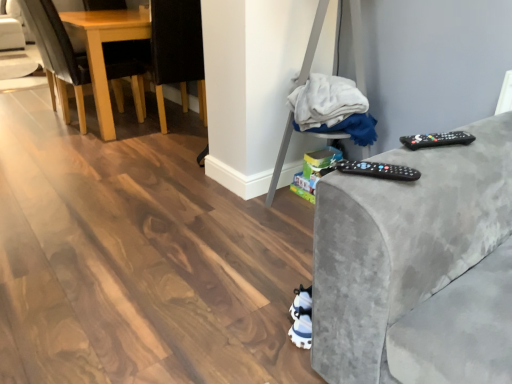
Measure the distance between white fabric at center and camera.

white fabric at center is 5.87 feet from camera.

The image size is (512, 384). What do you see at coordinates (176, 51) in the screenshot? I see `black fabric chair at left, which is counted as the 2th chair, starting from the left` at bounding box center [176, 51].

This screenshot has width=512, height=384. I want to click on light brown wood chair at left, the second chair in the right-to-left sequence, so click(57, 55).

Locate an element on the screen. The width and height of the screenshot is (512, 384). black plastic remote at right, the second remote in the right-to-left sequence is located at coordinates (378, 170).

This screenshot has width=512, height=384. Find the location of `the 1st remote above the white fabric at center (from a real-world perspective)`. the 1st remote above the white fabric at center (from a real-world perspective) is located at coordinates (378, 170).

Visually, is black plastic remote at right, the second remote viewed from the top, positioned to the left or to the right of white fabric at center?

black plastic remote at right, the second remote viewed from the top, is positioned on white fabric at center's left side.

Which is correct: black plastic remote at right, which appears as the first remote when viewed from the front, is inside white fabric at center, or outside of it?

black plastic remote at right, which appears as the first remote when viewed from the front, is outside white fabric at center.

Which object is further away from the camera, black plastic remote at right, the second remote in the right-to-left sequence, or white fabric at center?

white fabric at center is further away from the camera.

Considering the sizes of black plastic remote at right, the second remote from the back, and black plastic remote at right, arranged as the second remote when ordered from the bottom, in the image, is black plastic remote at right, the second remote from the back, wider or thinner than black plastic remote at right, arranged as the second remote when ordered from the bottom,?

black plastic remote at right, the second remote from the back, is thinner than black plastic remote at right, arranged as the second remote when ordered from the bottom.

Is black plastic remote at right, which appears as the 1th remote when viewed from the top, a part of black plastic remote at right, the first remote from the bottom?

Actually, black plastic remote at right, which appears as the 1th remote when viewed from the top, is outside black plastic remote at right, the first remote from the bottom.

From the picture: Is black plastic remote at right, the second remote from the back, facing away from black plastic remote at right, the second remote in the left-to-right sequence?

That's right, black plastic remote at right, the second remote from the back, is facing away from black plastic remote at right, the second remote in the left-to-right sequence.

Does light brown wood chair at left, the second chair in the right-to-left sequence, have a greater height compared to black plastic remote at right, which is the first remote from back to front?

Correct, light brown wood chair at left, the second chair in the right-to-left sequence, is much taller as black plastic remote at right, which is the first remote from back to front.

Is light brown wood chair at left, the 1th chair when ordered from left to right, directly adjacent to black plastic remote at right, the 2th remote viewed from the front?

No, light brown wood chair at left, the 1th chair when ordered from left to right, is not next to black plastic remote at right, the 2th remote viewed from the front.

Visually, is light brown wood chair at left, the 1th chair when ordered from left to right, positioned to the left or to the right of black plastic remote at right, acting as the 1th remote starting from the right?

Clearly, light brown wood chair at left, the 1th chair when ordered from left to right, is on the left of black plastic remote at right, acting as the 1th remote starting from the right, in the image.

Considering the sizes of objects black fabric chair at left, which is counted as the 2th chair, starting from the left, and light brown wood chair at left, the second chair in the right-to-left sequence, in the image provided, who is bigger, black fabric chair at left, which is counted as the 2th chair, starting from the left, or light brown wood chair at left, the second chair in the right-to-left sequence,?

light brown wood chair at left, the second chair in the right-to-left sequence, is bigger.

Considering the positions of objects black fabric chair at left, which is counted as the 2th chair, starting from the left, and light brown wood chair at left, the 1th chair when ordered from left to right, in the image provided, who is in front, black fabric chair at left, which is counted as the 2th chair, starting from the left, or light brown wood chair at left, the 1th chair when ordered from left to right,?

light brown wood chair at left, the 1th chair when ordered from left to right, is in front.

Could you measure the distance between black fabric chair at left, which is counted as the 2th chair, starting from the left, and light brown wood chair at left, the 1th chair when ordered from left to right?

They are 17.90 inches apart.

Considering the relative sizes of black fabric chair at left, which is the 1th chair in right-to-left order, and light brown wood chair at left, the second chair in the right-to-left sequence, in the image provided, is black fabric chair at left, which is the 1th chair in right-to-left order, shorter than light brown wood chair at left, the second chair in the right-to-left sequence,?

Yes.

From the picture: Is white fabric at center bigger or smaller than black fabric chair at left, which is the 1th chair in right-to-left order?

In the image, white fabric at center appears to be smaller than black fabric chair at left, which is the 1th chair in right-to-left order.

From their relative heights in the image, would you say white fabric at center is taller or shorter than black fabric chair at left, which is counted as the 2th chair, starting from the left?

Clearly, white fabric at center is shorter compared to black fabric chair at left, which is counted as the 2th chair, starting from the left.

From a real-world perspective, is white fabric at center on black fabric chair at left, which is counted as the 2th chair, starting from the left?

Correct, in the physical world, white fabric at center is higher than black fabric chair at left, which is counted as the 2th chair, starting from the left.

Between black fabric chair at left, which is the 1th chair in right-to-left order, and white fabric at center, which one is positioned in front?

white fabric at center.

Find the location of `material that is above the black fabric chair at left, which is the 1th chair in right-to-left order (from a real-world perspective)`. material that is above the black fabric chair at left, which is the 1th chair in right-to-left order (from a real-world perspective) is located at coordinates (332, 108).

Consider the image. Is white fabric at center surrounded by black fabric chair at left, which is counted as the 2th chair, starting from the left?

Actually, white fabric at center is outside black fabric chair at left, which is counted as the 2th chair, starting from the left.

Is black plastic remote at right, which appears as the 1th remote when viewed from the top, surrounding black plastic remote at right, the second remote in the right-to-left sequence?

That's incorrect, black plastic remote at right, the second remote in the right-to-left sequence, is not inside black plastic remote at right, which appears as the 1th remote when viewed from the top.

Does black plastic remote at right, the second remote in the left-to-right sequence, have a lesser width compared to black plastic remote at right, the second remote viewed from the top?

No, black plastic remote at right, the second remote in the left-to-right sequence, is not thinner than black plastic remote at right, the second remote viewed from the top.

From a real-world perspective, who is located higher, black plastic remote at right, which is the first remote from back to front, or black plastic remote at right, the second remote in the right-to-left sequence?

In real-world perspective, black plastic remote at right, which is the first remote from back to front, is above.

Between black plastic remote at right, which appears as the 1th remote when viewed from the top, and black plastic remote at right, the second remote viewed from the top, which one has smaller size?

black plastic remote at right, the second remote viewed from the top.

The image size is (512, 384). Find the location of `the 2nd remote below the white fabric at center (from the image's perspective)`. the 2nd remote below the white fabric at center (from the image's perspective) is located at coordinates (378, 170).

You are a GUI agent. You are given a task and a screenshot of the screen. Output one action in this format:
    pyautogui.click(x=<x>, y=<y>)
    Task: Click on the remote to the left of black plastic remote at right, arranged as the second remote when ordered from the bottom
    
    Given the screenshot: What is the action you would take?
    pyautogui.click(x=378, y=170)

Considering their positions, is light brown wood chair at left, the second chair in the right-to-left sequence, positioned closer to black plastic remote at right, the second remote viewed from the top, than black fabric chair at left, which is the 1th chair in right-to-left order?

Based on the image, black fabric chair at left, which is the 1th chair in right-to-left order, appears to be nearer to black plastic remote at right, the second remote viewed from the top.

Consider the image. Based on their spatial positions, is black fabric chair at left, which is counted as the 2th chair, starting from the left, or black plastic remote at right, the first remote from the bottom, closer to black plastic remote at right, which appears as the 1th remote when viewed from the top?

Among the two, black plastic remote at right, the first remote from the bottom, is located nearer to black plastic remote at right, which appears as the 1th remote when viewed from the top.

Based on their spatial positions, is black plastic remote at right, the second remote viewed from the top, or black fabric chair at left, which is counted as the 2th chair, starting from the left, closer to black plastic remote at right, the second remote in the left-to-right sequence?

black plastic remote at right, the second remote viewed from the top, lies closer to black plastic remote at right, the second remote in the left-to-right sequence, than the other object.

Estimate the real-world distances between objects in this image. Which object is closer to light brown wood chair at left, the second chair in the right-to-left sequence, black plastic remote at right, arranged as the second remote when ordered from the bottom, or white fabric at center?

Based on the image, white fabric at center appears to be nearer to light brown wood chair at left, the second chair in the right-to-left sequence.

Looking at the image, which one is located further to white fabric at center, black plastic remote at right, the second remote in the left-to-right sequence, or light brown wood chair at left, the 1th chair when ordered from left to right?

Based on the image, light brown wood chair at left, the 1th chair when ordered from left to right, appears to be further to white fabric at center.

Estimate the real-world distances between objects in this image. Which object is further from light brown wood chair at left, the 1th chair when ordered from left to right, white fabric at center or black plastic remote at right, the second remote viewed from the top?

The object further to light brown wood chair at left, the 1th chair when ordered from left to right, is black plastic remote at right, the second remote viewed from the top.

Based on their spatial positions, is white fabric at center or black plastic remote at right, the second remote in the left-to-right sequence, closer to black fabric chair at left, which is counted as the 2th chair, starting from the left?

white fabric at center is closer to black fabric chair at left, which is counted as the 2th chair, starting from the left.

When comparing their distances from white fabric at center, does light brown wood chair at left, the second chair in the right-to-left sequence, or black fabric chair at left, which is the 1th chair in right-to-left order, seem closer?

The object closer to white fabric at center is black fabric chair at left, which is the 1th chair in right-to-left order.

The height and width of the screenshot is (384, 512). I want to click on remote between light brown wood chair at left, the 1th chair when ordered from left to right, and white fabric at center, in the horizontal direction, so click(x=378, y=170).

The width and height of the screenshot is (512, 384). I want to click on material between light brown wood chair at left, the 1th chair when ordered from left to right, and black plastic remote at right, which is the first remote from back to front, so click(332, 108).

Image resolution: width=512 pixels, height=384 pixels. What are the coordinates of `material between black plastic remote at right, the second remote viewed from the top, and black fabric chair at left, which is counted as the 2th chair, starting from the left, from front to back` in the screenshot? It's located at (332, 108).

Locate an element on the screen. chair located between black plastic remote at right, the second remote from the back, and black fabric chair at left, which is counted as the 2th chair, starting from the left, in the depth direction is located at coordinates (57, 55).